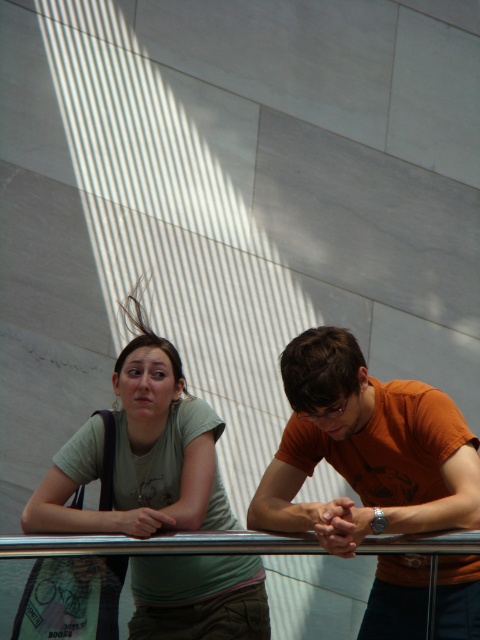
Question: Among these objects, which one is nearest to the camera?

Choices:
 (A) matte green t-shirt at center
 (B) orange cotton shirt at center

Answer: (B)

Question: Which object is farther from the camera taking this photo?

Choices:
 (A) orange cotton shirt at center
 (B) matte green t-shirt at center

Answer: (B)

Question: Does orange cotton shirt at center lie in front of matte green t-shirt at center?

Choices:
 (A) yes
 (B) no

Answer: (A)

Question: Is orange cotton shirt at center closer to the viewer compared to matte green t-shirt at center?

Choices:
 (A) no
 (B) yes

Answer: (B)

Question: Can you confirm if orange cotton shirt at center is bigger than matte green t-shirt at center?

Choices:
 (A) no
 (B) yes

Answer: (A)